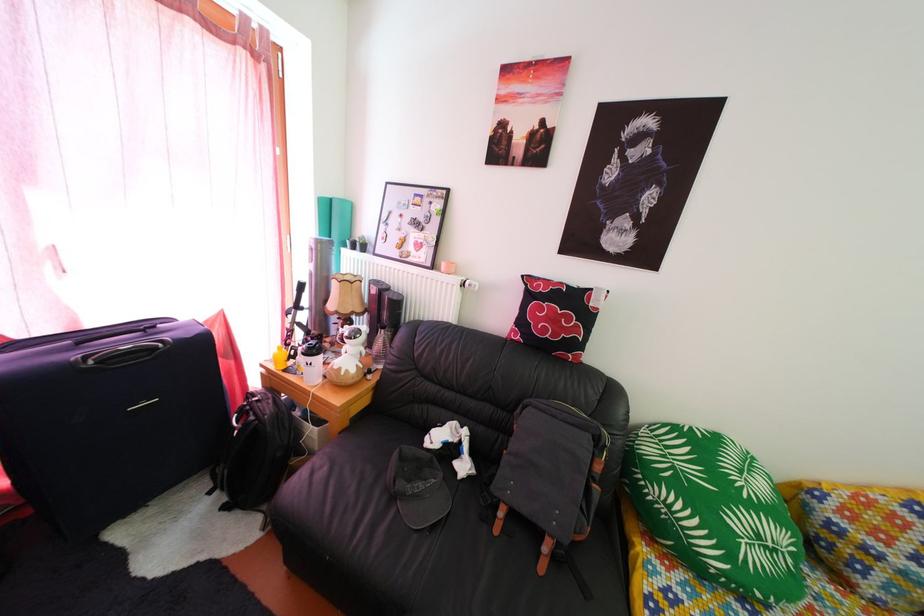
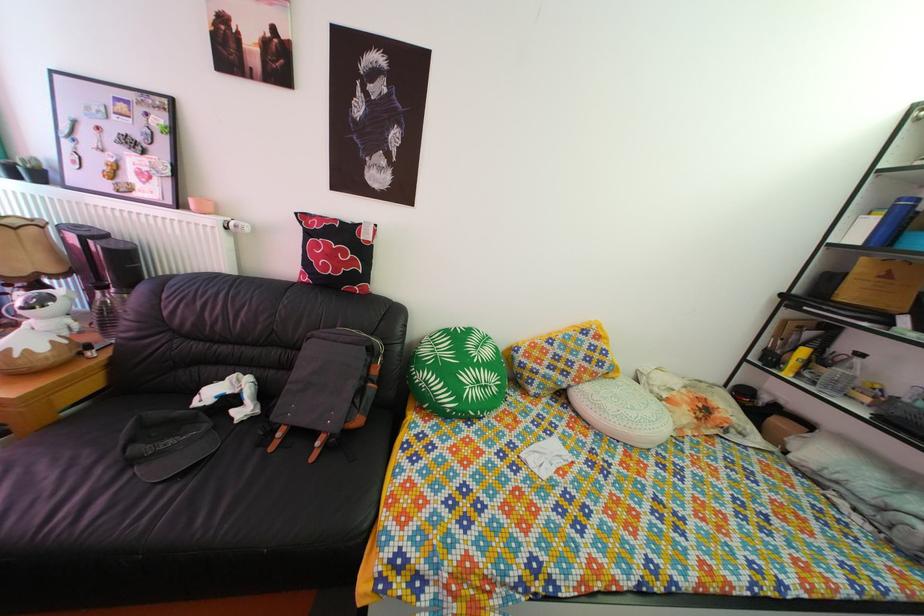
In the second image, find the point that corresponds to pixel 482 292 in the first image.

(249, 232)